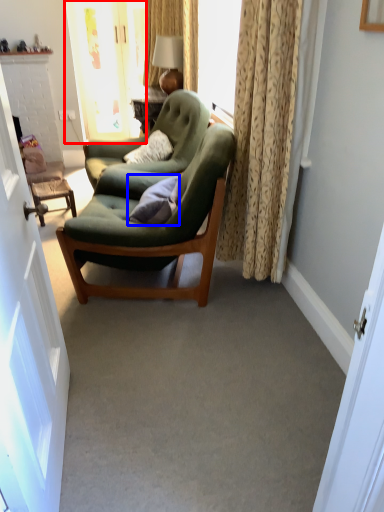
Question: Which point is closer to the camera, glass door (highlighted by a red box) or pillow (highlighted by a blue box)?

Choices:
 (A) glass door
 (B) pillow

Answer: (B)